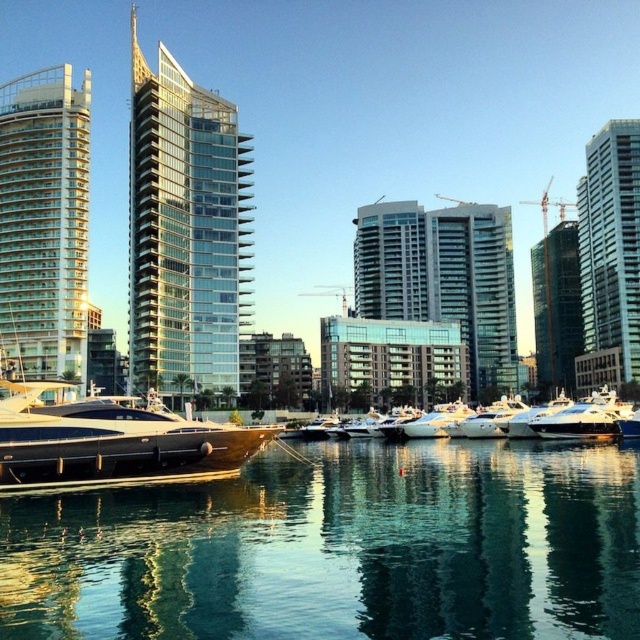
Question: Can you confirm if transparent glass skyscraper at center is thinner than white glass building at left?

Choices:
 (A) yes
 (B) no

Answer: (B)

Question: Is clear glass water at center positioned before glassy silver skyscraper at right?

Choices:
 (A) no
 (B) yes

Answer: (B)

Question: Which point is farther to the camera?

Choices:
 (A) transparent glass skyscraper at center
 (B) glassy concrete building at center

Answer: (B)

Question: Does transparent glass skyscraper at center lie behind white glossy boats at center?

Choices:
 (A) no
 (B) yes

Answer: (B)

Question: Which of the following is the closest to the observer?

Choices:
 (A) glassy concrete building at center
 (B) glassy silver skyscraper at right
 (C) shiny black yacht at center
 (D) transparent glass skyscraper at center

Answer: (C)

Question: Considering the real-world distances, which object is farthest from the clear glass water at center?

Choices:
 (A) glassy concrete building at center
 (B) white glass building at left
 (C) transparent glass skyscraper at center
 (D) glassy silver skyscraper at right

Answer: (A)